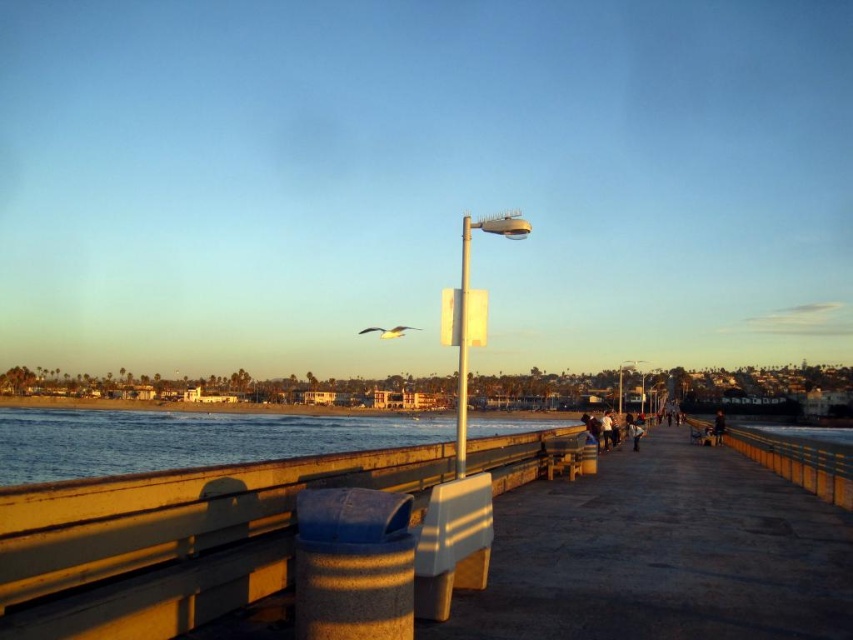
Does dark blue jeans at center come in front of dark fabric bag at lower right?

Yes, dark blue jeans at center is closer to the viewer.

Is point (601, 426) farther from viewer compared to point (718, 422)?

No, it is not.

Locate an element on the screen. dark blue jeans at center is located at coordinates (606, 429).

Between point (462, 456) and point (399, 328), which one is positioned behind?

Positioned behind is point (399, 328).

Can you confirm if white plastic pole at center is positioned to the right of white feathered gull at center?

Indeed, white plastic pole at center is positioned on the right side of white feathered gull at center.

This screenshot has height=640, width=853. What are the coordinates of `white plastic pole at center` in the screenshot? It's located at (462, 349).

The image size is (853, 640). In order to click on white plastic pole at center in this screenshot , I will do `click(462, 349)`.

Consider the image. Which of these two, metallic pole at center or dark fabric bag at lower right, stands shorter?

Standing shorter between the two is metallic pole at center.

Who is higher up, metallic pole at center or dark fabric bag at lower right?

metallic pole at center is higher up.

Which is in front, point (459, 456) or point (712, 435)?

Positioned in front is point (459, 456).

Locate an element on the screen. metallic pole at center is located at coordinates (468, 312).